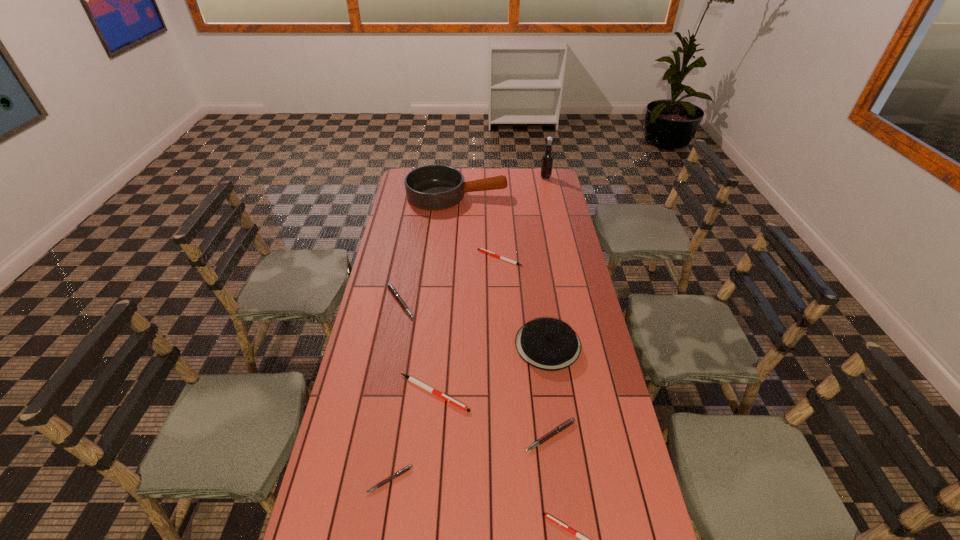
The width and height of the screenshot is (960, 540). In order to click on the second smallest pink pen in this screenshot , I will do click(x=557, y=430).

Where is `the seventh nearest object`? The height and width of the screenshot is (540, 960). the seventh nearest object is located at coordinates (481, 249).

I want to click on the second smallest white pen, so click(481, 249).

Find the location of a particular element. The image size is (960, 540). the fifth farthest pen is located at coordinates (409, 467).

Find the location of `the second nearest object`. the second nearest object is located at coordinates (409, 467).

Find the location of a particular element. The height and width of the screenshot is (540, 960). blank area located on the label of the tallest object is located at coordinates (506, 178).

Identify the location of free region located 0.400m on the label of the tallest object. The height and width of the screenshot is (540, 960). coord(468,178).

Image resolution: width=960 pixels, height=540 pixels. In order to click on vacant region located on the label of the tallest object in this screenshot , I will do `click(522, 178)`.

At what (x,y) coordinates should I click in order to perform the action: click on vacant area located on the handle side of the gray pan. Please return your answer as a coordinate pair (x, y). The image size is (960, 540). Looking at the image, I should click on (557, 195).

This screenshot has height=540, width=960. I want to click on vacant region located 0.170m on the back of the pancake, so click(x=540, y=289).